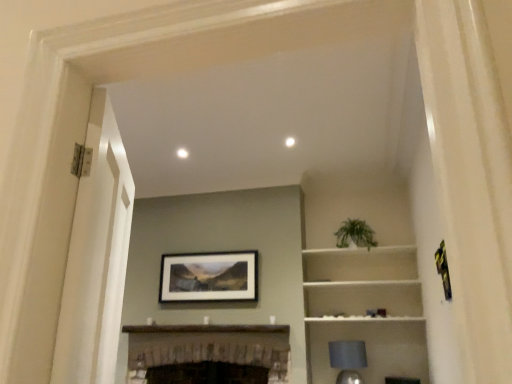
Measure the distance between point (368, 247) and camera.

4.09 meters.

Describe the element at coordinates (348, 360) in the screenshot. I see `matte gray lampshade at lower right` at that location.

The height and width of the screenshot is (384, 512). Find the location of `green leafy plant at upper center`. green leafy plant at upper center is located at coordinates 355,234.

From a real-world perspective, which is physically below, green leafy plant at upper center or white matte cabinet at upper right?

white matte cabinet at upper right, from a real-world perspective.

Which is behind, green leafy plant at upper center or white matte cabinet at upper right?

green leafy plant at upper center is behind.

Consider the image. Considering the sizes of objects green leafy plant at upper center and white matte cabinet at upper right in the image provided, who is smaller, green leafy plant at upper center or white matte cabinet at upper right?

green leafy plant at upper center.

Is point (354, 241) in front of point (311, 312)?

Yes.

Is white glossy door at left far away from green leafy plant at upper center?

That's right, there is a large distance between white glossy door at left and green leafy plant at upper center.

Is white glossy door at left to the left of green leafy plant at upper center from the viewer's perspective?

Yes.

In terms of width, does white glossy door at left look wider or thinner when compared to green leafy plant at upper center?

Clearly, white glossy door at left has less width compared to green leafy plant at upper center.

Where is `plant on the right of the white glossy door at left`? plant on the right of the white glossy door at left is located at coordinates (355, 234).

Which of these two, matte black picture frame at center or dark brown wood fireplace at center, is wider?

dark brown wood fireplace at center.

Is matte black picture frame at center situated inside dark brown wood fireplace at center or outside?

matte black picture frame at center lies outside dark brown wood fireplace at center.

Based on the photo, which point is more forward, (237, 300) or (217, 326)?

The point (217, 326) is closer to the camera.

From the image's perspective, which is above, matte black picture frame at center or dark brown wood fireplace at center?

matte black picture frame at center, from the image's perspective.

Is dark brown wood fireplace at center positioned beyond the bounds of white glossy door at left?

Yes, dark brown wood fireplace at center is not within white glossy door at left.

Is the position of dark brown wood fireplace at center more distant than that of white glossy door at left?

Yes, the depth of dark brown wood fireplace at center is greater than that of white glossy door at left.

Looking at this image, considering the sizes of dark brown wood fireplace at center and white glossy door at left in the image, is dark brown wood fireplace at center wider or thinner than white glossy door at left?

Considering their sizes, dark brown wood fireplace at center looks broader than white glossy door at left.

What's the angular difference between dark brown wood fireplace at center and matte gray lampshade at lower right's facing directions?

4.23 degrees separate the facing orientations of dark brown wood fireplace at center and matte gray lampshade at lower right.

From a real-world perspective, is dark brown wood fireplace at center over matte gray lampshade at lower right?

Yes, from a real-world perspective, dark brown wood fireplace at center is on top of matte gray lampshade at lower right.

Is dark brown wood fireplace at center in front of matte gray lampshade at lower right?

Yes, it is in front of matte gray lampshade at lower right.

Is matte gray lampshade at lower right completely or partially inside dark brown wood fireplace at center?

No, matte gray lampshade at lower right is not surrounded by dark brown wood fireplace at center.

Does green leafy plant at upper center appear on the right side of dark brown wood fireplace at center?

Yes, green leafy plant at upper center is to the right of dark brown wood fireplace at center.

Between point (353, 241) and point (267, 331), which one is positioned behind?

Point (353, 241)

From the picture: Between green leafy plant at upper center and dark brown wood fireplace at center, which one has larger width?

With larger width is dark brown wood fireplace at center.

Between point (160, 328) and point (386, 302), which one is positioned in front?

The point (386, 302) is closer.

Which of these two, dark brown wood fireplace at center or white matte cabinet at upper right, is thinner?

white matte cabinet at upper right.

Would you say dark brown wood fireplace at center is a long distance from white matte cabinet at upper right?

dark brown wood fireplace at center is actually quite close to white matte cabinet at upper right.

The width and height of the screenshot is (512, 384). In order to click on cabinet on the right of green leafy plant at upper center in this screenshot , I will do `click(362, 298)`.

At what (x,y) coordinates should I click in order to perform the action: click on plant located above the white glossy door at left (from a real-world perspective). Please return your answer as a coordinate pair (x, y). Looking at the image, I should click on (355, 234).

Which object lies nearer to the anchor point matte gray lampshade at lower right, matte black picture frame at center or green leafy plant at upper center?

green leafy plant at upper center lies closer to matte gray lampshade at lower right than the other object.

From the image, which object appears to be nearer to green leafy plant at upper center, dark brown wood fireplace at center or matte gray lampshade at lower right?

matte gray lampshade at lower right lies closer to green leafy plant at upper center than the other object.

Looking at this image, considering their positions, is matte black picture frame at center positioned further to green leafy plant at upper center than white matte cabinet at upper right?

A: Based on the image, matte black picture frame at center appears to be further to green leafy plant at upper center.

In the scene shown: When comparing their distances from white matte cabinet at upper right, does green leafy plant at upper center or white glossy door at left seem further?

The object further to white matte cabinet at upper right is white glossy door at left.

When comparing their distances from white matte cabinet at upper right, does matte gray lampshade at lower right or white glossy door at left seem closer?

The object closer to white matte cabinet at upper right is matte gray lampshade at lower right.

Based on their spatial positions, is green leafy plant at upper center or white glossy door at left closer to matte gray lampshade at lower right?

green leafy plant at upper center.

Based on their spatial positions, is dark brown wood fireplace at center or white matte cabinet at upper right closer to matte gray lampshade at lower right?

white matte cabinet at upper right.

Looking at the image, which one is located further to matte gray lampshade at lower right, white matte cabinet at upper right or white glossy door at left?

Based on the image, white glossy door at left appears to be further to matte gray lampshade at lower right.

Where is `lamp located between white glossy door at left and green leafy plant at upper center in the depth direction`? lamp located between white glossy door at left and green leafy plant at upper center in the depth direction is located at coordinates (348, 360).

Image resolution: width=512 pixels, height=384 pixels. In order to click on cabinet between white glossy door at left and green leafy plant at upper center in the front-back direction in this screenshot , I will do `click(362, 298)`.

The image size is (512, 384). Find the location of `lamp situated between matte black picture frame at center and white matte cabinet at upper right from left to right`. lamp situated between matte black picture frame at center and white matte cabinet at upper right from left to right is located at coordinates (348, 360).

Find the location of a particular element. cabinet that lies between green leafy plant at upper center and matte gray lampshade at lower right from top to bottom is located at coordinates (362, 298).